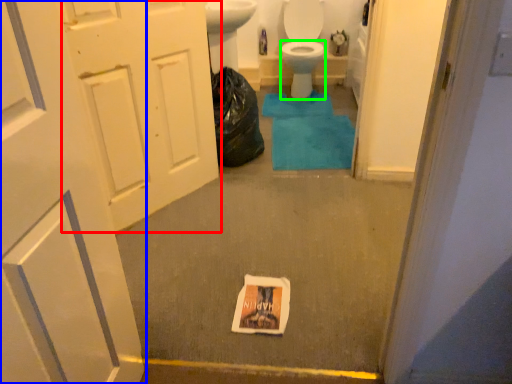
Question: Which is nearer to the door (highlighted by a red box)? door (highlighted by a blue box) or bidet (highlighted by a green box).

Choices:
 (A) door
 (B) bidet

Answer: (A)